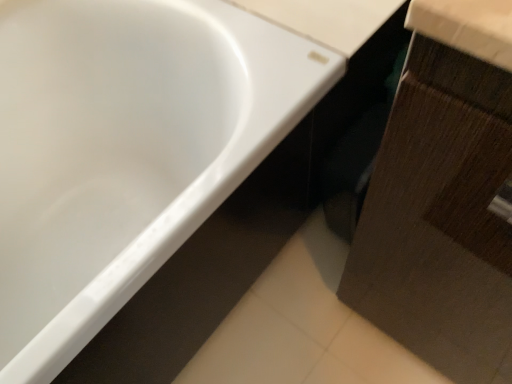
What is the approximate width of white glossy bathtub at upper left?

white glossy bathtub at upper left is 27.32 inches wide.

The height and width of the screenshot is (384, 512). I want to click on white glossy bathtub at upper left, so click(x=125, y=150).

This screenshot has height=384, width=512. What do you see at coordinates (125, 150) in the screenshot?
I see `white glossy bathtub at upper left` at bounding box center [125, 150].

The image size is (512, 384). What do you see at coordinates (440, 219) in the screenshot?
I see `brown wood cabinet at lower right` at bounding box center [440, 219].

Measure the distance between point (470, 74) and camera.

The distance of point (470, 74) from camera is 37.90 centimeters.

This screenshot has width=512, height=384. I want to click on brown wood cabinet at lower right, so click(440, 219).

Locate an element on the screen. The height and width of the screenshot is (384, 512). white glossy bathtub at upper left is located at coordinates point(125,150).

Which object is positioned more to the left, white glossy bathtub at upper left or brown wood cabinet at lower right?

white glossy bathtub at upper left.

Is the depth of white glossy bathtub at upper left greater than that of brown wood cabinet at lower right?

That is True.

Is point (200, 130) more distant than point (444, 52)?

Yes, it is behind point (444, 52).

From the image's perspective, is white glossy bathtub at upper left on brown wood cabinet at lower right?

Correct, white glossy bathtub at upper left appears higher than brown wood cabinet at lower right in the image.

From a real-world perspective, between white glossy bathtub at upper left and brown wood cabinet at lower right, who is vertically lower?

white glossy bathtub at upper left is physically lower.

Can you confirm if white glossy bathtub at upper left is wider than brown wood cabinet at lower right?

Indeed, white glossy bathtub at upper left has a greater width compared to brown wood cabinet at lower right.

Between white glossy bathtub at upper left and brown wood cabinet at lower right, which one has less height?

With less height is white glossy bathtub at upper left.

Does white glossy bathtub at upper left have a larger size compared to brown wood cabinet at lower right?

Yes.

Is white glossy bathtub at upper left inside the boundaries of brown wood cabinet at lower right, or outside?

white glossy bathtub at upper left is spatially situated outside brown wood cabinet at lower right.

Is white glossy bathtub at upper left next to brown wood cabinet at lower right?

No, white glossy bathtub at upper left is not with brown wood cabinet at lower right.

Is white glossy bathtub at upper left looking in the opposite direction of brown wood cabinet at lower right?

No.

How far apart are white glossy bathtub at upper left and brown wood cabinet at lower right?

white glossy bathtub at upper left and brown wood cabinet at lower right are 19.14 inches apart from each other.

Identify the location of cabinetry positioned vertically above the white glossy bathtub at upper left (from a real-world perspective). Image resolution: width=512 pixels, height=384 pixels. (440, 219).

Between brown wood cabinet at lower right and white glossy bathtub at upper left, which one appears on the left side from the viewer's perspective?

white glossy bathtub at upper left.

Considering the positions of objects brown wood cabinet at lower right and white glossy bathtub at upper left in the image provided, who is in front, brown wood cabinet at lower right or white glossy bathtub at upper left?

Positioned in front is brown wood cabinet at lower right.

Does point (387, 243) come behind point (174, 151)?

No, (387, 243) is closer to viewer.

From the image's perspective, is brown wood cabinet at lower right under white glossy bathtub at upper left?

Yes.

From a real-world perspective, is brown wood cabinet at lower right physically below white glossy bathtub at upper left?

No, from a real-world perspective, brown wood cabinet at lower right is not beneath white glossy bathtub at upper left.

Considering the sizes of objects brown wood cabinet at lower right and white glossy bathtub at upper left in the image provided, who is wider, brown wood cabinet at lower right or white glossy bathtub at upper left?

white glossy bathtub at upper left.

Between brown wood cabinet at lower right and white glossy bathtub at upper left, which one has more height?

With more height is brown wood cabinet at lower right.

Is brown wood cabinet at lower right smaller than white glossy bathtub at upper left?

Yes.

Would you say brown wood cabinet at lower right is inside or outside white glossy bathtub at upper left?

brown wood cabinet at lower right is outside white glossy bathtub at upper left.

Is brown wood cabinet at lower right far away from white glossy bathtub at upper left?

brown wood cabinet at lower right is actually quite close to white glossy bathtub at upper left.

Is brown wood cabinet at lower right positioned with its back to white glossy bathtub at upper left?

brown wood cabinet at lower right does not have its back to white glossy bathtub at upper left.

How many degrees apart are the facing directions of brown wood cabinet at lower right and white glossy bathtub at upper left?

They differ by 90.5 degrees in their facing directions.

The image size is (512, 384). In order to click on cabinetry in front of the white glossy bathtub at upper left in this screenshot , I will do `click(440, 219)`.

This screenshot has width=512, height=384. In order to click on bathtub located underneath the brown wood cabinet at lower right (from a real-world perspective) in this screenshot , I will do `click(125, 150)`.

Where is `cabinetry in front of the white glossy bathtub at upper left`? The height and width of the screenshot is (384, 512). cabinetry in front of the white glossy bathtub at upper left is located at coordinates pos(440,219).